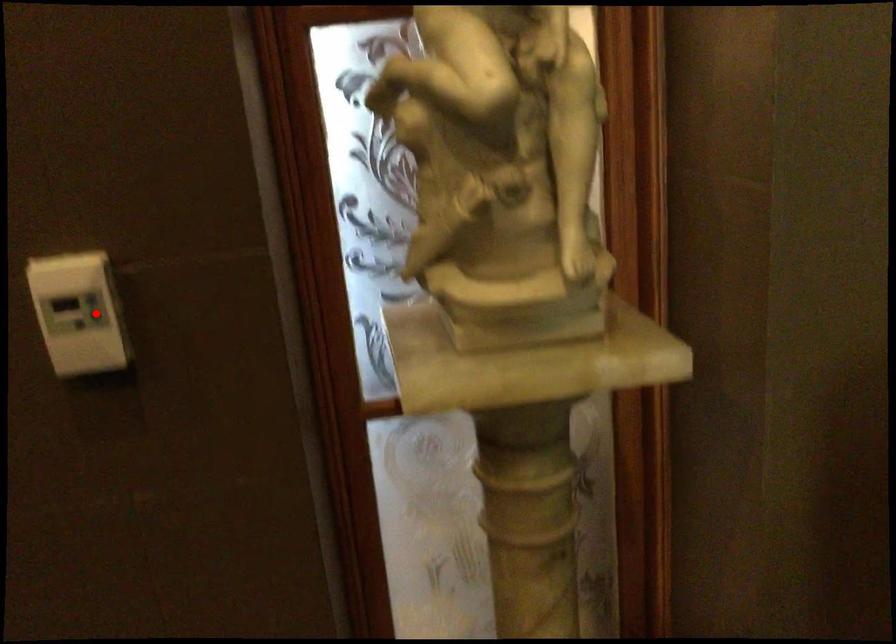
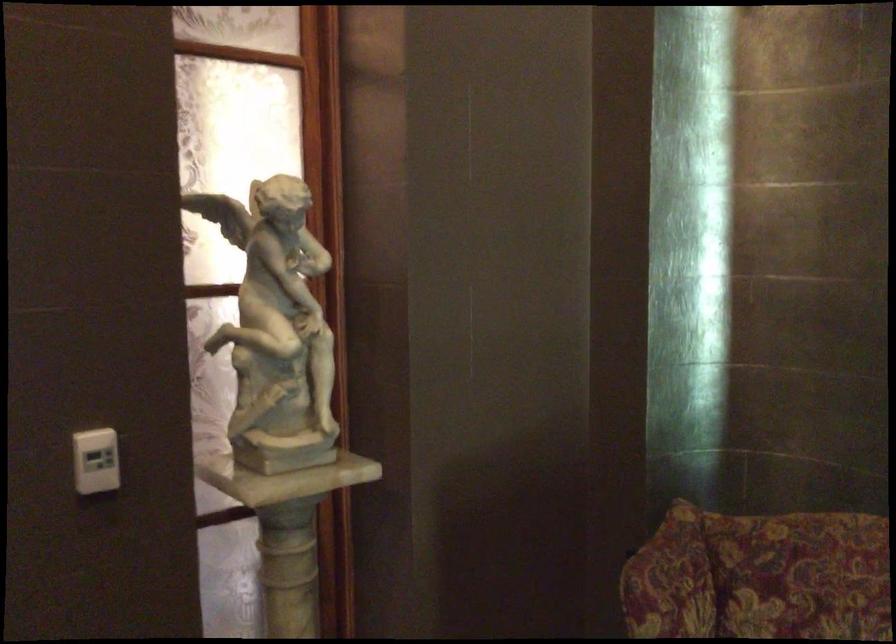
Question: I am providing you with two images of the same scene from different viewpoints. Given a red point in image1, look at the same physical point in image2. Is it:

Choices:
 (A) Closer to the viewpoint
 (B) Farther from the viewpoint

Answer: (B)